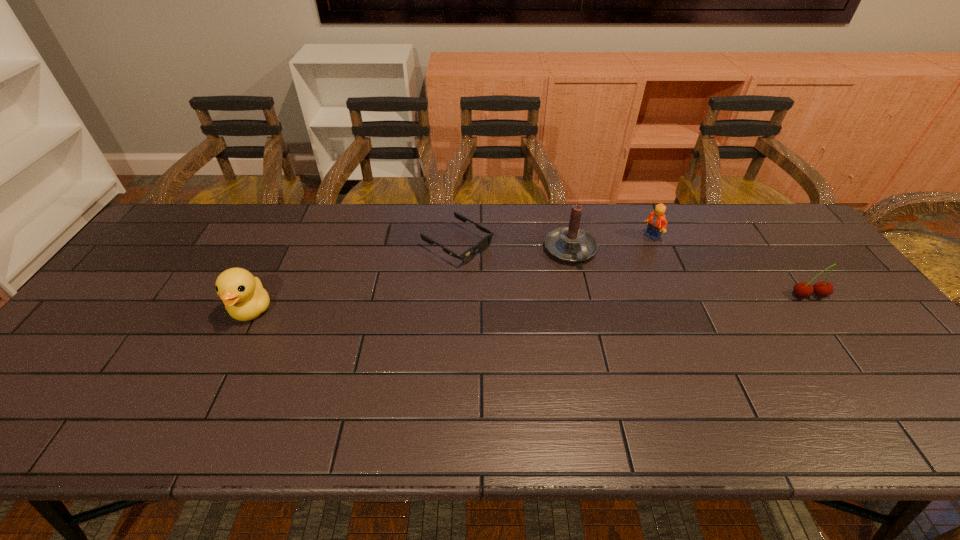
Locate an element on the screen. Image resolution: width=960 pixels, height=540 pixels. duck is located at coordinates (245, 299).

Identify the location of cherry. (822, 288).

Locate an element on the screen. This screenshot has width=960, height=540. sunglasses is located at coordinates (467, 256).

At what (x,y) coordinates should I click in order to perform the action: click on the second object from left to right. Please return your answer as a coordinate pair (x, y). This screenshot has width=960, height=540. Looking at the image, I should click on (467, 256).

Find the location of a particular element. the fourth object from left to right is located at coordinates (657, 223).

Where is `the third object from left to right`? Image resolution: width=960 pixels, height=540 pixels. the third object from left to right is located at coordinates (571, 244).

The image size is (960, 540). I want to click on vacant space situated on the face of the leftmost object, so click(x=208, y=398).

Locate an element on the screen. This screenshot has height=540, width=960. free space located on the surface of the rightmost object is located at coordinates (842, 341).

Find the location of `vacant space located on the temples of the shortest object`. vacant space located on the temples of the shortest object is located at coordinates (574, 312).

I want to click on free spot located 0.180m on the temples of the shortest object, so click(x=534, y=289).